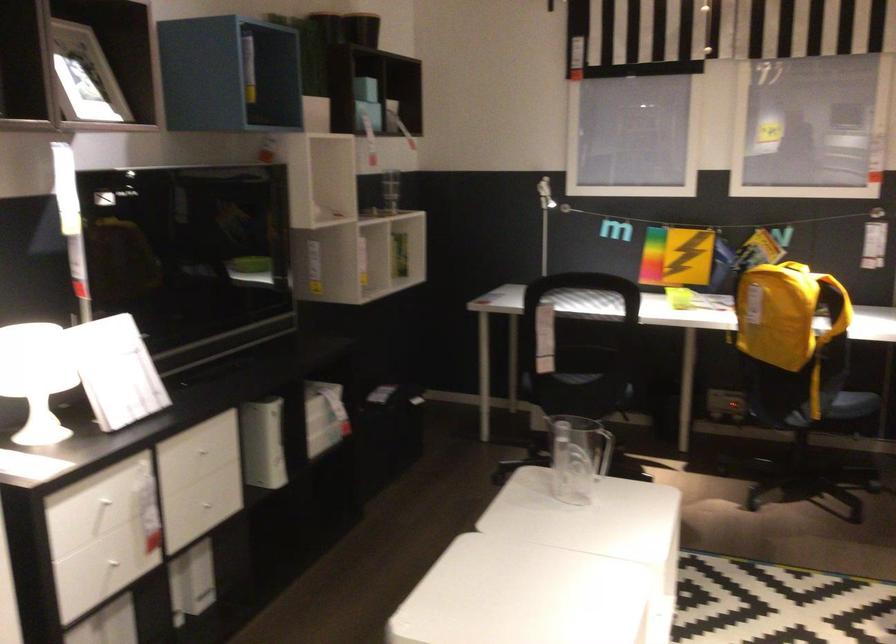
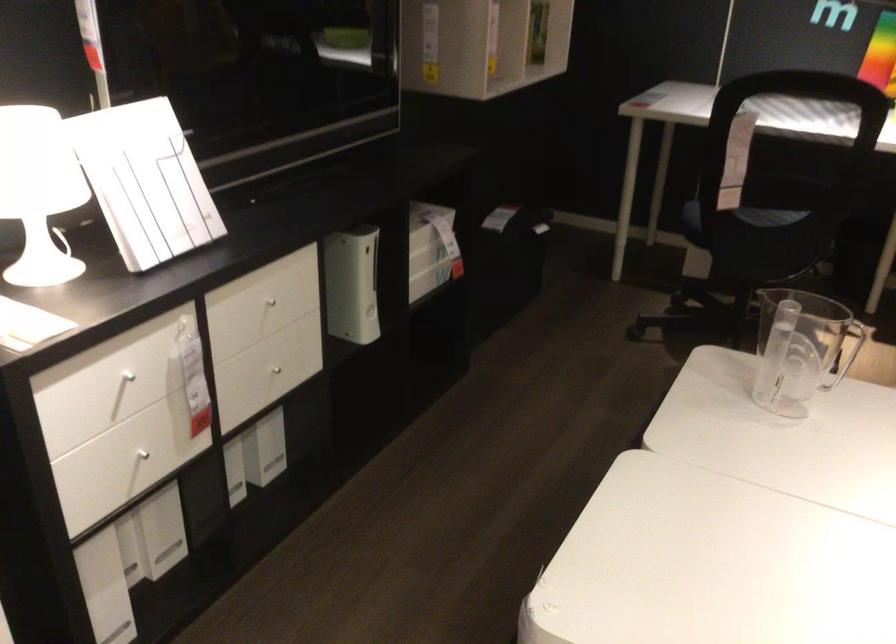
Find the pixel in the second image that matches [106,506] in the first image.

(126, 377)